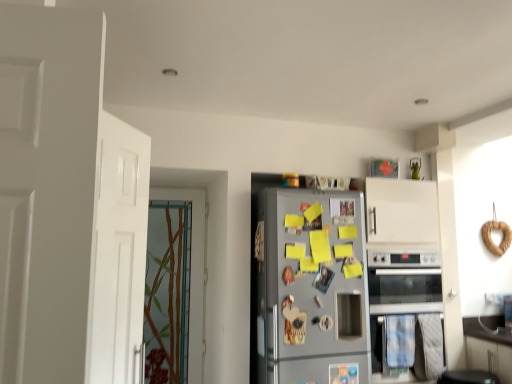
Question: From a real-world perspective, is translucent glass door at left, the first door in the back-to-front sequence, physically located above or below white matte door at left, marked as the first door in a front-to-back arrangement?

Choices:
 (A) above
 (B) below

Answer: (B)

Question: In terms of height, does translucent glass door at left, the second door from the front, look taller or shorter compared to white matte door at left, the 2th door from the back?

Choices:
 (A) short
 (B) tall

Answer: (B)

Question: Which of these objects is positioned closest to the satin silver oven at lower right?

Choices:
 (A) white matte door at left, marked as the first door in a front-to-back arrangement
 (B) baked wheat bagel at right
 (C) satin silver fridge at center
 (D) translucent glass door at left, the first door in the back-to-front sequence

Answer: (C)

Question: Considering the real-world distances, which object is closest to the white matte door at left, the 2th door from the back?

Choices:
 (A) satin silver oven at lower right
 (B) translucent glass door at left, the second door from the front
 (C) baked wheat bagel at right
 (D) satin silver fridge at center

Answer: (D)